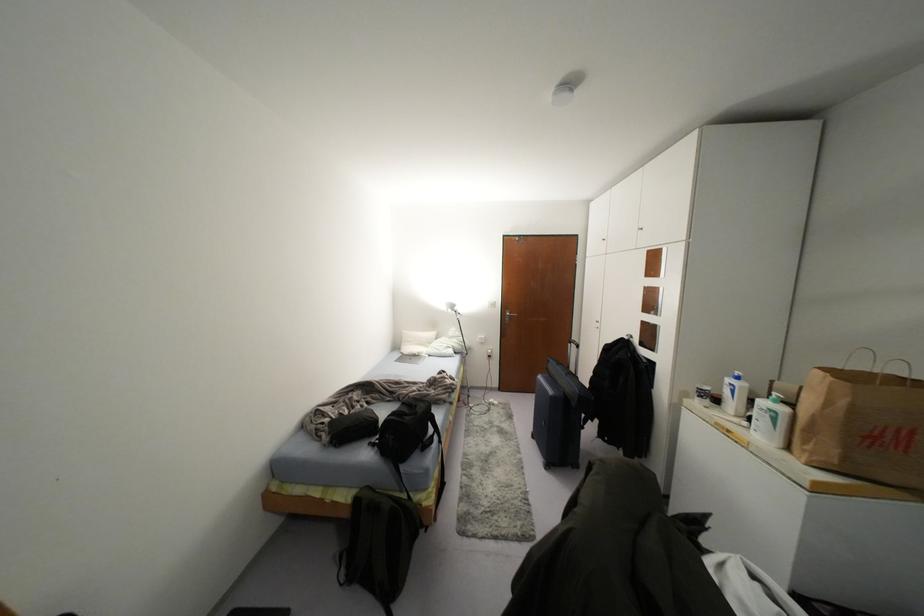
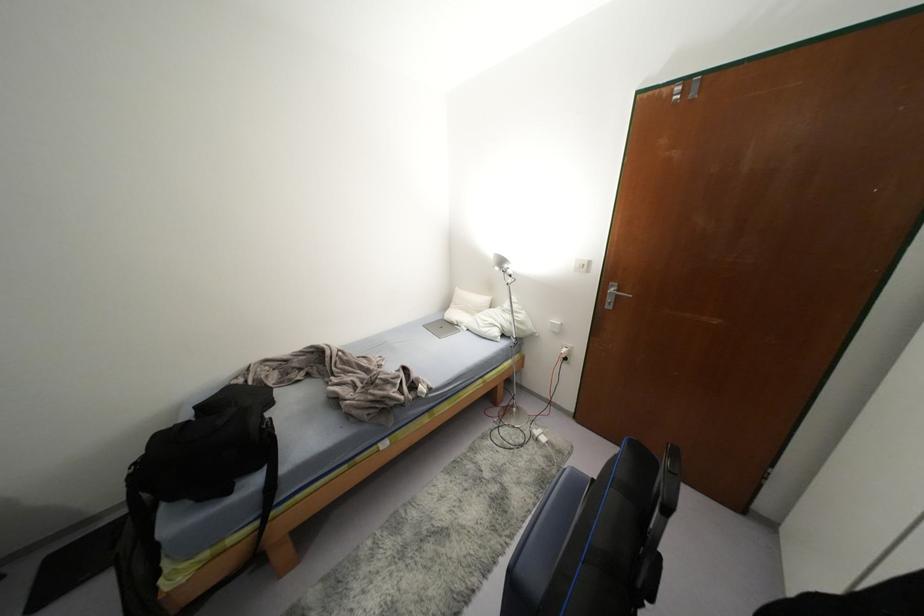
Find the pixel in the second image that matches point 431,334 in the first image.

(484, 299)